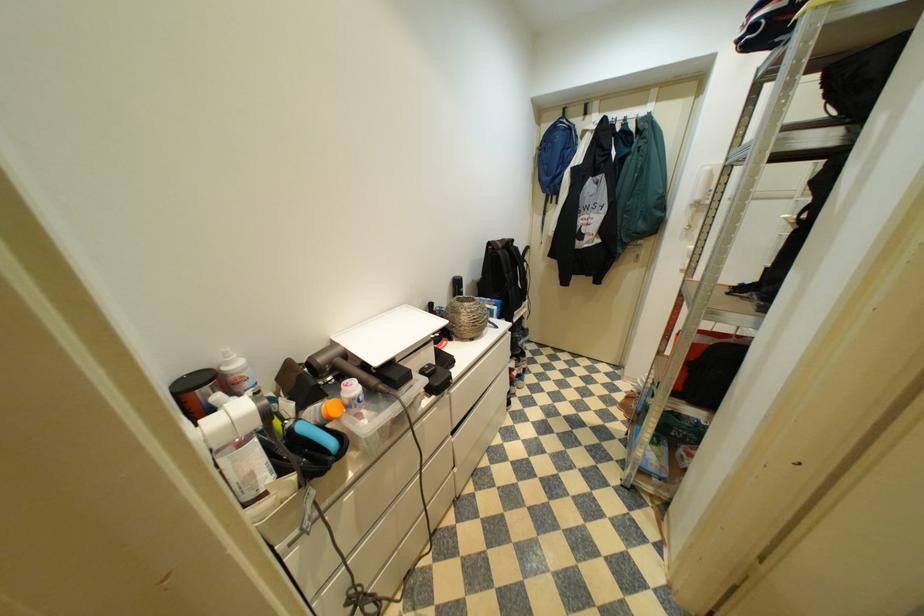
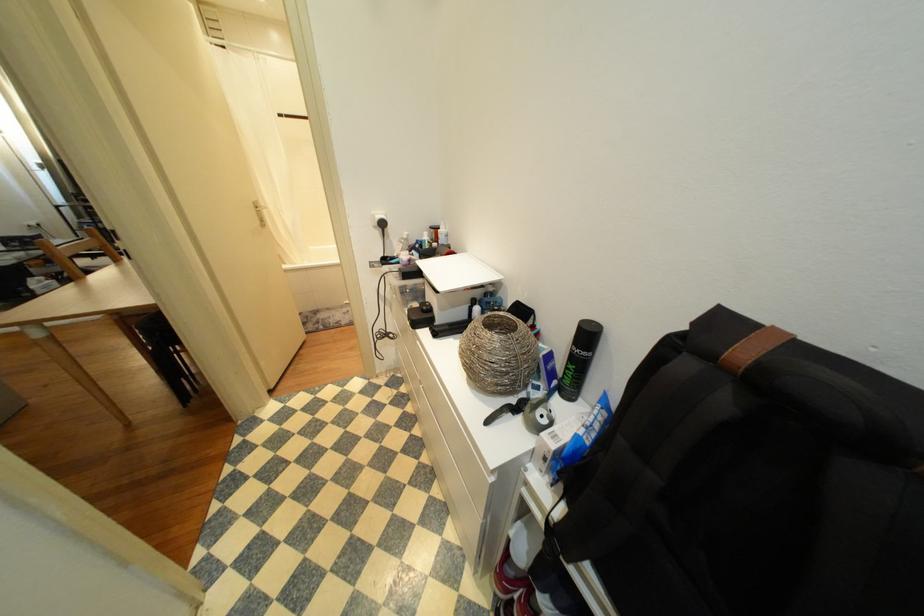
The point at (490, 339) is marked in the first image. Where is the corresponding point in the second image?

(476, 384)